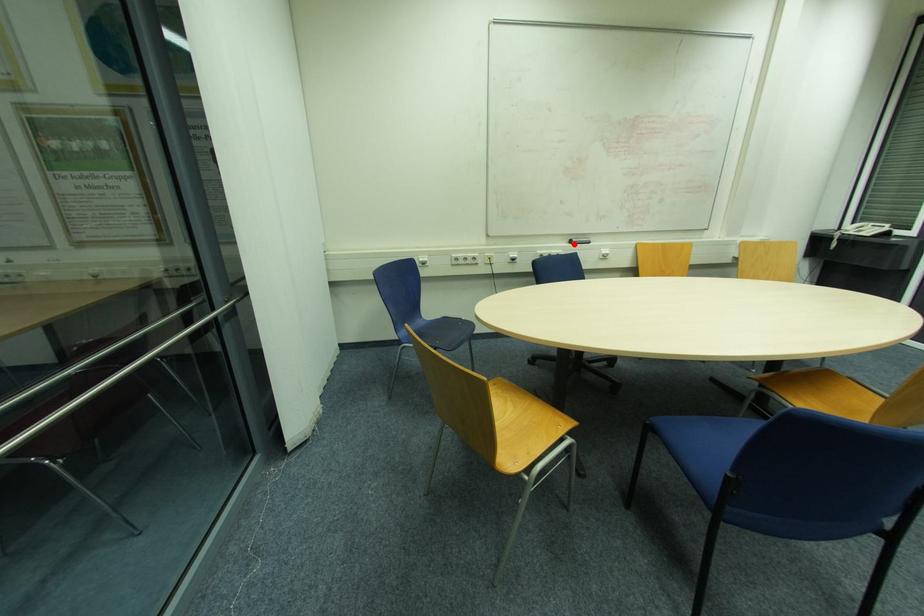
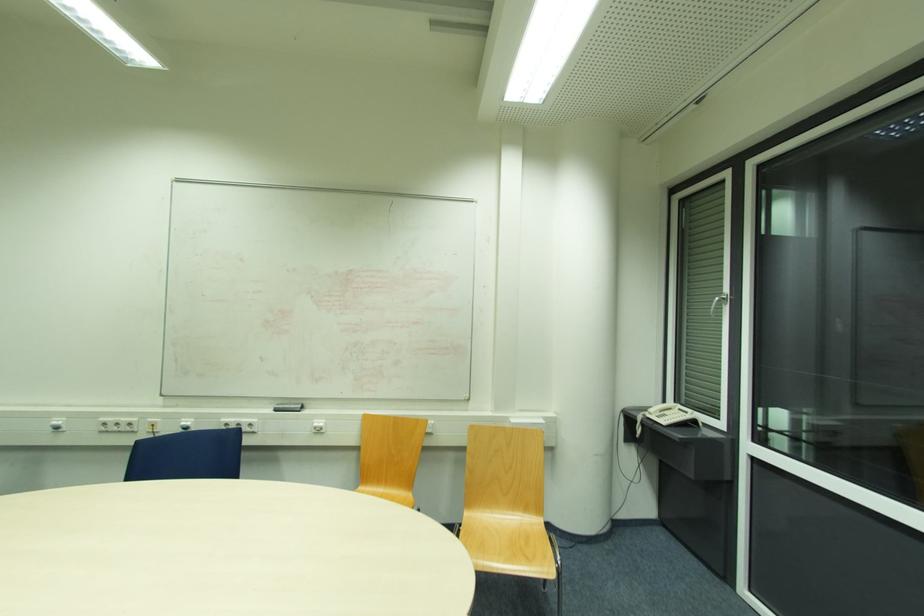
In the second image, find the point that corresponds to the highlighted location in the first image.

(276, 411)